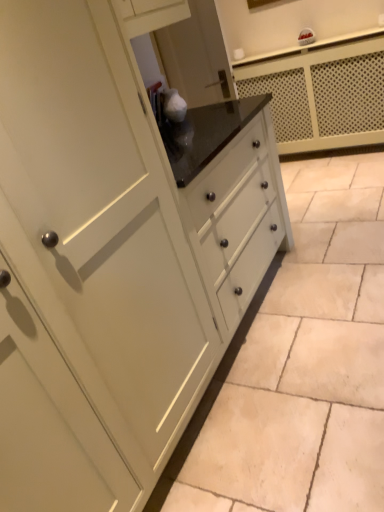
Question: Can you confirm if white glossy counter at upper center is wider than matte white cabinet at center?

Choices:
 (A) yes
 (B) no

Answer: (B)

Question: From the image's perspective, would you say white glossy counter at upper center is positioned over matte white cabinet at center?

Choices:
 (A) no
 (B) yes

Answer: (B)

Question: Considering the relative sizes of white glossy counter at upper center and matte white cabinet at center in the image provided, is white glossy counter at upper center bigger than matte white cabinet at center?

Choices:
 (A) yes
 (B) no

Answer: (A)

Question: Can you confirm if white glossy counter at upper center is smaller than matte white cabinet at center?

Choices:
 (A) yes
 (B) no

Answer: (B)

Question: Considering the relative positions of white glossy counter at upper center and matte white cabinet at center in the image provided, is white glossy counter at upper center to the right of matte white cabinet at center from the viewer's perspective?

Choices:
 (A) no
 (B) yes

Answer: (B)

Question: Is white glossy counter at upper center facing towards matte white cabinet at center?

Choices:
 (A) yes
 (B) no

Answer: (A)

Question: From a real-world perspective, is matte white cabinet at center positioned under white glossy counter at upper center based on gravity?

Choices:
 (A) yes
 (B) no

Answer: (A)

Question: Is matte white cabinet at center taller than white glossy counter at upper center?

Choices:
 (A) no
 (B) yes

Answer: (A)

Question: From a real-world perspective, is matte white cabinet at center physically above white glossy counter at upper center?

Choices:
 (A) yes
 (B) no

Answer: (B)

Question: Can you confirm if matte white cabinet at center is positioned to the right of white glossy counter at upper center?

Choices:
 (A) no
 (B) yes

Answer: (A)

Question: Is matte white cabinet at center in contact with white glossy counter at upper center?

Choices:
 (A) no
 (B) yes

Answer: (A)

Question: Is matte white cabinet at center thinner than white glossy counter at upper center?

Choices:
 (A) no
 (B) yes

Answer: (A)

Question: From a real-world perspective, relative to white glossy counter at upper center, is matte white cabinet at center vertically above or below?

Choices:
 (A) above
 (B) below

Answer: (B)